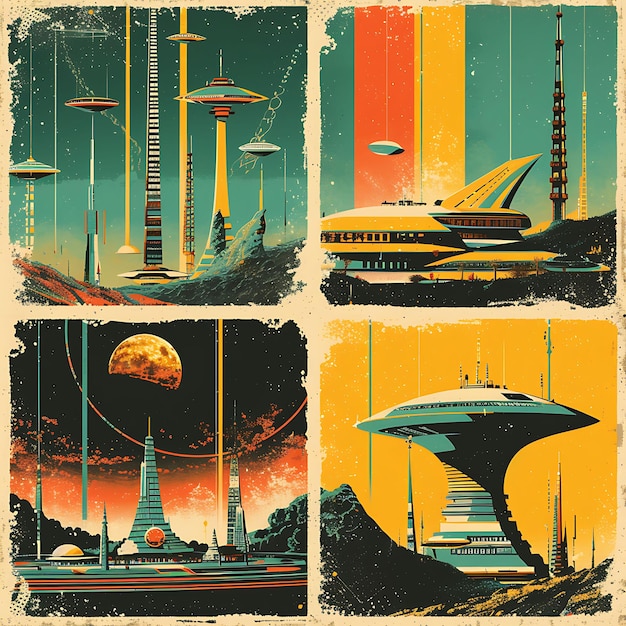
You are a GUI agent. You are given a task and a screenshot of the screen. Output one action in this format:
    pyautogui.click(x=<x>, y=<y>)
    Task: Click on the beam
    The height and width of the screenshot is (626, 626).
    Given the screenshot: What is the action you would take?
    pyautogui.click(x=129, y=165), pyautogui.click(x=186, y=44), pyautogui.click(x=221, y=162), pyautogui.click(x=380, y=88), pyautogui.click(x=442, y=63)